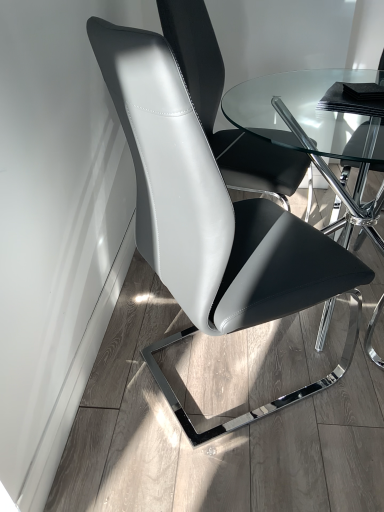
Question: Considering the positions of point (198, 77) and point (178, 185), is point (198, 77) closer or farther from the camera than point (178, 185)?

Choices:
 (A) closer
 (B) farther

Answer: (B)

Question: Is white leather chair at center, the 2th chair viewed from the front, in front of or behind matte black chair at center, the 1th chair when ordered from front to back, in the image?

Choices:
 (A) behind
 (B) front

Answer: (A)

Question: Based on their relative distances, which object is farther from the white leather chair at center, the 2th chair viewed from the front?

Choices:
 (A) matte black chair at center, the 1th chair when ordered from front to back
 (B) transparent glass table at center

Answer: (A)

Question: Considering the real-world distances, which object is closest to the white leather chair at center, the 2th chair viewed from the front?

Choices:
 (A) matte black chair at center, positioned as the second chair in back-to-front order
 (B) transparent glass table at center

Answer: (B)